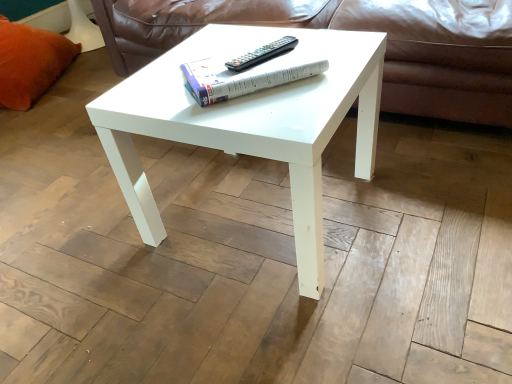
Locate an element on the screen. This screenshot has width=512, height=384. free space to the left of black plastic remote at center is located at coordinates pyautogui.click(x=212, y=64).